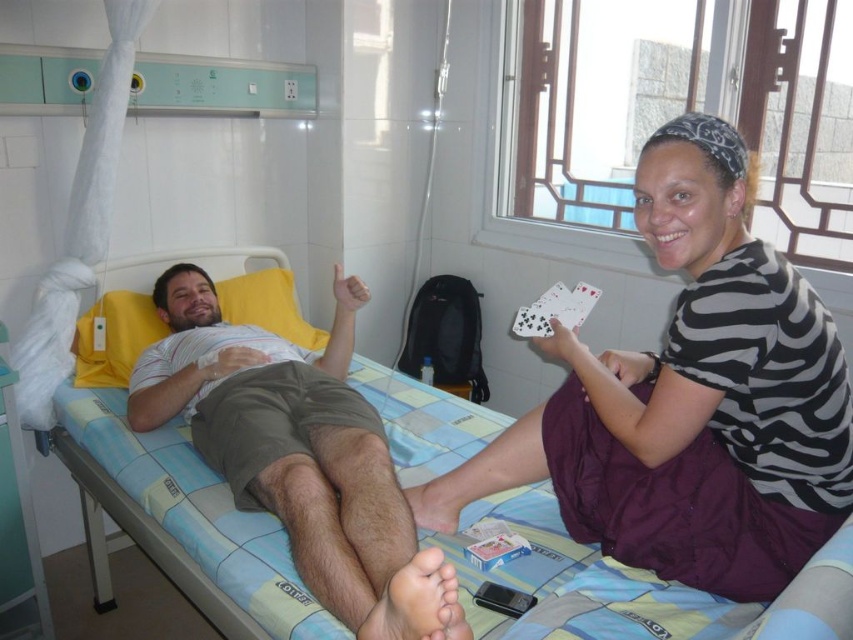
Between zebra-patterned fabric at upper right and blue fabric hospital bed at center, which one is positioned higher?

zebra-patterned fabric at upper right is above.

Can you confirm if zebra-patterned fabric at upper right is bigger than blue fabric hospital bed at center?

No, zebra-patterned fabric at upper right is not bigger than blue fabric hospital bed at center.

Between point (573, 477) and point (599, 570), which one is positioned in front?

Point (599, 570) is in front.

You are a GUI agent. You are given a task and a screenshot of the screen. Output one action in this format:
    pyautogui.click(x=<x>, y=<y>)
    Task: Click on the zebra-patterned fabric at upper right
    The width and height of the screenshot is (853, 640).
    Given the screenshot: What is the action you would take?
    pyautogui.click(x=689, y=401)

Can you confirm if zebra-patterned fabric at upper right is bigger than matte khaki shorts at center?

No, zebra-patterned fabric at upper right is not bigger than matte khaki shorts at center.

Is zebra-patterned fabric at upper right above matte khaki shorts at center?

Yes, zebra-patterned fabric at upper right is above matte khaki shorts at center.

In order to click on zebra-patterned fabric at upper right in this screenshot , I will do 689,401.

Which is below, matte khaki shorts at center or white paper cards at center?

matte khaki shorts at center

Measure the distance between matte khaki shorts at center and white paper cards at center.

A distance of 24.09 inches exists between matte khaki shorts at center and white paper cards at center.

Where is `matte khaki shorts at center`? matte khaki shorts at center is located at coordinates (300, 458).